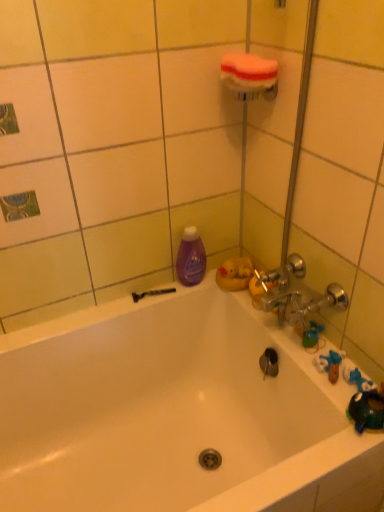
You are a GUI agent. You are given a task and a screenshot of the screen. Output one action in this format:
    pyautogui.click(x=<x>, y=<y>)
    Task: Click on the green rubber toy at right
    Image resolution: width=384 pixels, height=512 pixels.
    Given the screenshot: What is the action you would take?
    pyautogui.click(x=312, y=336)

Describe the element at coordinates (176, 413) in the screenshot. This screenshot has height=512, width=384. I see `white glossy bathtub at center` at that location.

I want to click on purple glossy bottle at upper left, so click(191, 258).

Is black plastic razor at lower left bigger or smaller than purple glossy bottle at upper left?

In the image, black plastic razor at lower left appears to be smaller than purple glossy bottle at upper left.

Is black plastic razor at lower left outside of purple glossy bottle at upper left?

That's correct, black plastic razor at lower left is outside of purple glossy bottle at upper left.

From the image's perspective, which one is positioned higher, black plastic razor at lower left or purple glossy bottle at upper left?

purple glossy bottle at upper left is shown above in the image.

Is black plastic razor at lower left facing away from purple glossy bottle at upper left?

No, black plastic razor at lower left is not facing the opposite direction of purple glossy bottle at upper left.

Based on the photo, between purple glossy bottle at upper left and white glossy bathtub at center, which one has smaller size?

With smaller size is purple glossy bottle at upper left.

Is purple glossy bottle at upper left aimed at white glossy bathtub at center?

No.

Identify the location of bathtub below the purple glossy bottle at upper left (from a real-world perspective). (176, 413).

Is orange sponge at upper center not within white glossy bathtub at center?

Yes, orange sponge at upper center is not within white glossy bathtub at center.

Does orange sponge at upper center have a greater width compared to white glossy bathtub at center?

No.

Identify the location of towel bar above the white glossy bathtub at center (from a real-world perspective). (250, 76).

Which is farther, (246,91) or (279,485)?

The point (246,91) is farther.

Does white glossy bathtub at center contain orange sponge at upper center?

That's incorrect, orange sponge at upper center is not inside white glossy bathtub at center.

Does white glossy bathtub at center have a lesser width compared to orange sponge at upper center?

No.

Is orange sponge at upper center at the back of white glossy bathtub at center?

white glossy bathtub at center does not have its back to orange sponge at upper center.

Considering the relative sizes of white glossy bathtub at center and orange sponge at upper center in the image provided, is white glossy bathtub at center smaller than orange sponge at upper center?

Incorrect, white glossy bathtub at center is not smaller in size than orange sponge at upper center.

Considering the relative sizes of white glossy bathtub at center and purple glossy bottle at upper left in the image provided, is white glossy bathtub at center bigger than purple glossy bottle at upper left?

Yes, white glossy bathtub at center is bigger than purple glossy bottle at upper left.

From the image's perspective, does white glossy bathtub at center appear lower than purple glossy bottle at upper left?

Yes, from the image's perspective, white glossy bathtub at center is below purple glossy bottle at upper left.

Looking at this image, are white glossy bathtub at center and purple glossy bottle at upper left making contact?

No, white glossy bathtub at center is not with purple glossy bottle at upper left.

From a real-world perspective, who is located higher, green rubber toy at right or orange sponge at upper center?

In real-world perspective, orange sponge at upper center is above.

From the image's perspective, does green rubber toy at right appear lower than orange sponge at upper center?

Yes.

Who is more distant, green rubber toy at right or orange sponge at upper center?

green rubber toy at right.

Is green rubber toy at right inside the boundaries of orange sponge at upper center, or outside?

green rubber toy at right is outside orange sponge at upper center.

Considering the relative sizes of green rubber toy at right and purple glossy bottle at upper left in the image provided, is green rubber toy at right bigger than purple glossy bottle at upper left?

No.

Does point (319, 331) appear closer or farther from the camera than point (189, 284)?

Point (319, 331) appears to be closer to the viewer than point (189, 284).

What's the angular difference between green rubber toy at right and purple glossy bottle at upper left's facing directions?

There is a 90-degree angle between the facing directions of green rubber toy at right and purple glossy bottle at upper left.

Is green rubber toy at right in front of or behind purple glossy bottle at upper left in the image?

Clearly, green rubber toy at right is in front of purple glossy bottle at upper left.

At what (x,y) coordinates should I click in order to perform the action: click on cleaning product in front of the black plastic razor at lower left. Please return your answer as a coordinate pair (x, y). This screenshot has width=384, height=512. Looking at the image, I should click on (191, 258).

Where is `cleaning product on the right of white glossy bathtub at center`? cleaning product on the right of white glossy bathtub at center is located at coordinates (191, 258).

Estimate the real-world distances between objects in this image. Which object is further from orange sponge at upper center, purple glossy bottle at upper left or green rubber toy at right?

The object further to orange sponge at upper center is green rubber toy at right.

From the image, which object appears to be farther from purple glossy bottle at upper left, white glossy bathtub at center or orange sponge at upper center?

orange sponge at upper center lies further to purple glossy bottle at upper left than the other object.

When comparing their distances from white glossy bathtub at center, does green rubber toy at right or purple glossy bottle at upper left seem further?

green rubber toy at right is positioned further to the anchor white glossy bathtub at center.

Looking at the image, which one is located further to purple glossy bottle at upper left, green rubber toy at right or black plastic razor at lower left?

green rubber toy at right.

Looking at the image, which one is located closer to black plastic razor at lower left, orange sponge at upper center or green rubber toy at right?

Among the two, green rubber toy at right is located nearer to black plastic razor at lower left.

When comparing their distances from black plastic razor at lower left, does orange sponge at upper center or purple glossy bottle at upper left seem further?

orange sponge at upper center.

Looking at the image, which one is located closer to white glossy bathtub at center, purple glossy bottle at upper left or orange sponge at upper center?

purple glossy bottle at upper left is closer to white glossy bathtub at center.

When comparing their distances from green rubber toy at right, does black plastic razor at lower left or purple glossy bottle at upper left seem closer?

purple glossy bottle at upper left is positioned closer to the anchor green rubber toy at right.

I want to click on cleaning product that lies between orange sponge at upper center and green rubber toy at right from top to bottom, so click(x=191, y=258).

Locate an element on the screen. cleaning product between white glossy bathtub at center and black plastic razor at lower left along the z-axis is located at coordinates (191, 258).

Locate an element on the screen. cleaning product between orange sponge at upper center and black plastic razor at lower left vertically is located at coordinates (191, 258).

Image resolution: width=384 pixels, height=512 pixels. Find the location of `cleaning product between black plastic razor at lower left and green rubber toy at right`. cleaning product between black plastic razor at lower left and green rubber toy at right is located at coordinates (191, 258).